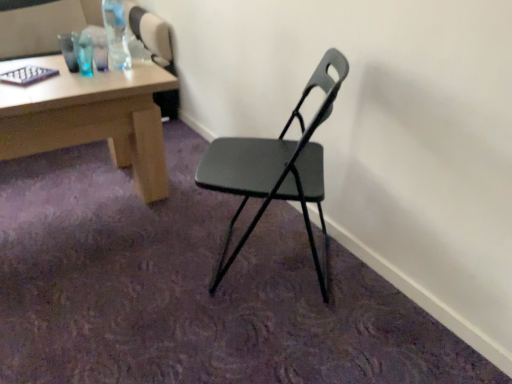
Find the location of a particular element. The width and height of the screenshot is (512, 384). vacant area that lies in front of matte black chair at center is located at coordinates (258, 340).